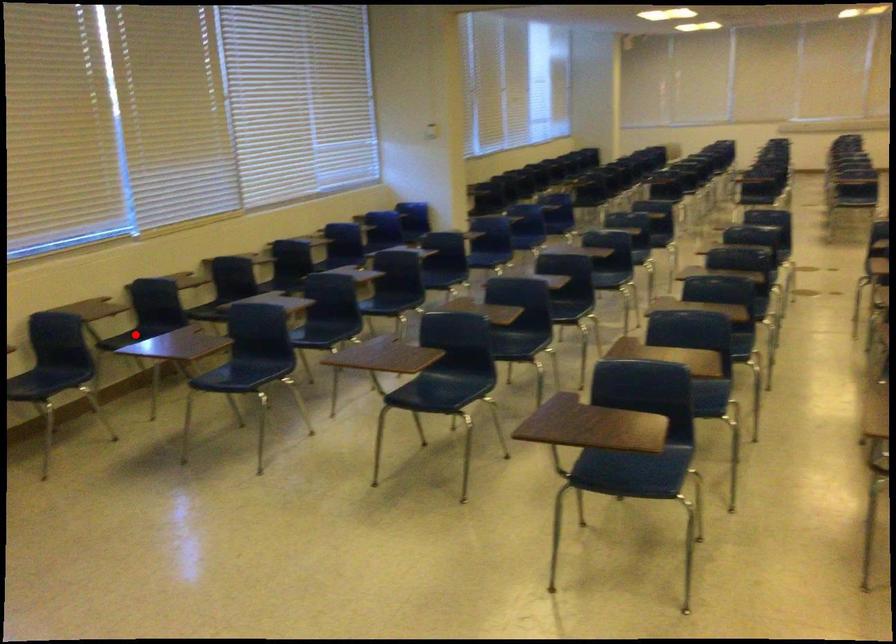
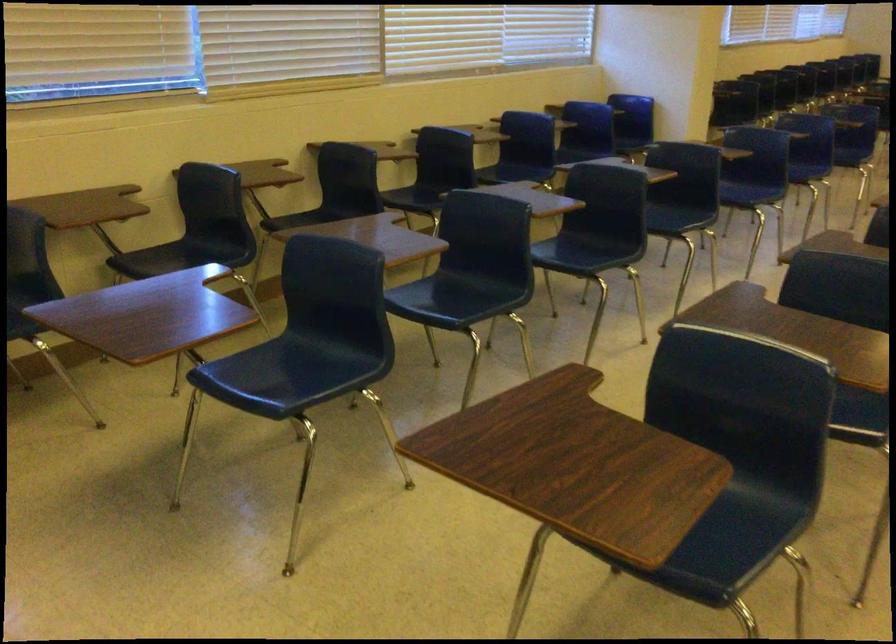
Locate, in the second image, the point that corresponds to the highlighted location in the first image.

(181, 257)